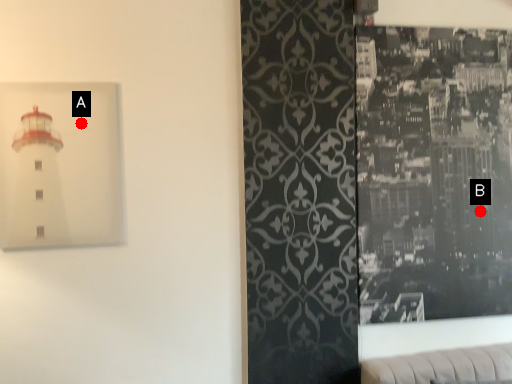
Question: Two points are circled on the image, labeled by A and B beside each circle. Which point is further to the camera?

Choices:
 (A) A is further
 (B) B is further

Answer: (B)